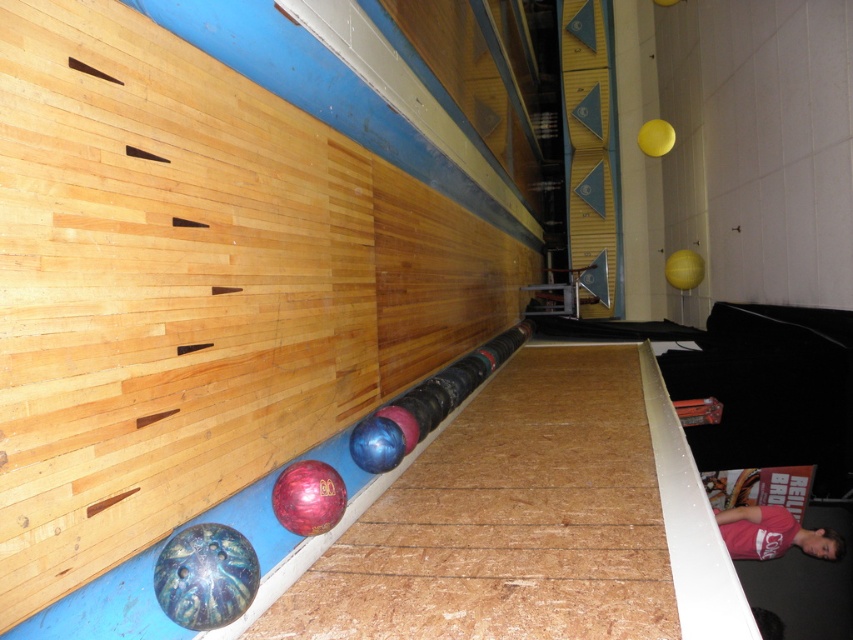
Question: Is shiny blue bowling ball at lower left below shiny pink bowling ball at lower center?

Choices:
 (A) no
 (B) yes

Answer: (B)

Question: Is shiny blue bowling ball at lower left to the left of shiny pink bowling ball at lower center from the viewer's perspective?

Choices:
 (A) yes
 (B) no

Answer: (A)

Question: Which object is positioned farthest from the blue glossy bowling ball at center?

Choices:
 (A) shiny pink bowling ball at lower center
 (B) shiny blue bowling ball at lower left

Answer: (B)

Question: Is shiny blue bowling ball at lower left to the left of blue glossy bowling ball at center from the viewer's perspective?

Choices:
 (A) yes
 (B) no

Answer: (A)

Question: Which point appears farthest from the camera in this image?

Choices:
 (A) (329, 490)
 (B) (212, 540)

Answer: (A)

Question: Which point is closer to the camera?

Choices:
 (A) shiny blue bowling ball at lower left
 (B) blue glossy bowling ball at center

Answer: (A)